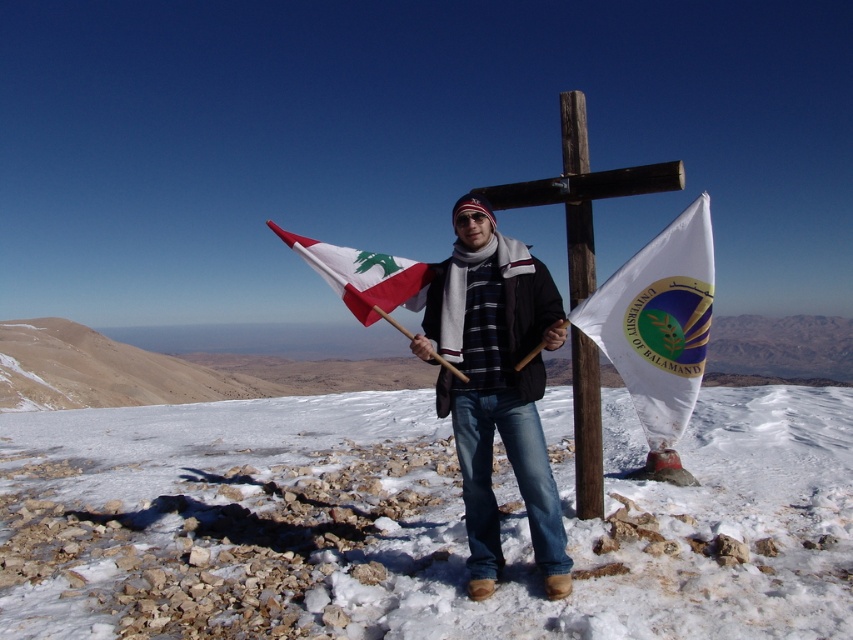
You are a photographer trying to capture the wooden cross structure at the center of the snowy mountain peak. You notice a point marked at coordinates (582, 192) in your camera viewfinder. Is this point likely part of the wooden cross structure?

The point at (582, 192) corresponds to the wooden cross structure at center, so yes, it is part of the wooden cross structure.

You are a photographer capturing the scene of a person on a snowy mountain peak. You need to focus your camera on the dark blue jeans at center. What are the coordinates where you should aim your camera?

The coordinates to aim the camera at are point [496,385].

You are a photographer trying to capture the person in the scene. Since you want to focus on their clothing, which object between the dark blue jeans at center and the white fabric flag at center should you zoom in on to ensure it takes up more space in the photo?

The dark blue jeans at center should be zoomed in on because its width is less than the white fabric flag at center, meaning it will appear smaller in the photo and requires closer focus to fill the frame.